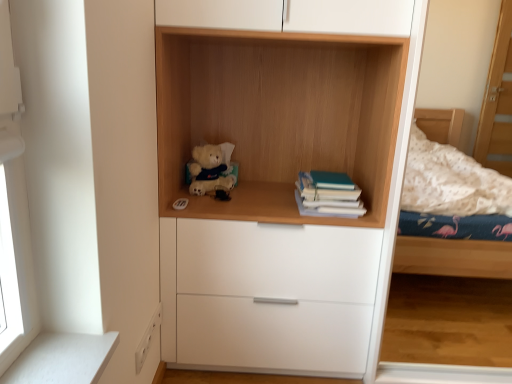
Question: Is teal matte book at right inside wooden shelf at center?

Choices:
 (A) yes
 (B) no

Answer: (A)

Question: Can you confirm if wooden shelf at center is wider than teal matte book at right?

Choices:
 (A) yes
 (B) no

Answer: (A)

Question: Does wooden shelf at center turn towards teal matte book at right?

Choices:
 (A) no
 (B) yes

Answer: (B)

Question: Is wooden shelf at center located outside teal matte book at right?

Choices:
 (A) no
 (B) yes

Answer: (B)

Question: From the image's perspective, is wooden shelf at center above teal matte book at right?

Choices:
 (A) no
 (B) yes

Answer: (B)

Question: Is wooden shelf at center at the right side of teal matte book at right?

Choices:
 (A) yes
 (B) no

Answer: (B)

Question: Is soft plush teddy bear at center positioned behind wooden shelf at center?

Choices:
 (A) no
 (B) yes

Answer: (B)

Question: Is soft plush teddy bear at center positioned far away from wooden shelf at center?

Choices:
 (A) no
 (B) yes

Answer: (A)

Question: Is soft plush teddy bear at center wider than wooden shelf at center?

Choices:
 (A) no
 (B) yes

Answer: (A)

Question: Is wooden shelf at center surrounded by soft plush teddy bear at center?

Choices:
 (A) yes
 (B) no

Answer: (B)

Question: Does soft plush teddy bear at center have a lesser height compared to wooden shelf at center?

Choices:
 (A) yes
 (B) no

Answer: (A)

Question: Can you confirm if soft plush teddy bear at center is thinner than wooden shelf at center?

Choices:
 (A) no
 (B) yes

Answer: (B)

Question: Considering the relative sizes of teal matte book at right and wooden shelf at center in the image provided, is teal matte book at right smaller than wooden shelf at center?

Choices:
 (A) yes
 (B) no

Answer: (A)